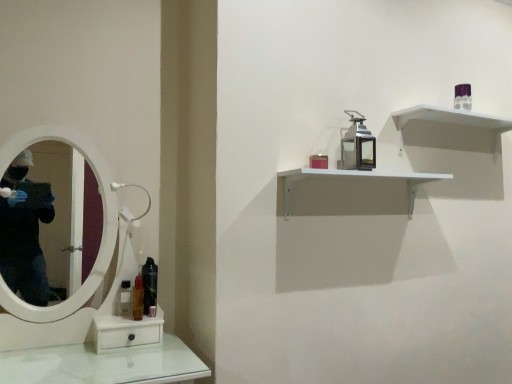
Describe the element at coordinates (463, 97) in the screenshot. I see `purple glossy perfume at upper right, arranged as the 1th toiletry when viewed from the top` at that location.

What do you see at coordinates (138, 297) in the screenshot? I see `translucent plastic mouthwash at left, marked as the 2th mouthwash in a right-to-left arrangement` at bounding box center [138, 297].

Measure the distance between point (150, 301) and camera.

Point (150, 301) is 1.67 meters from camera.

Where is `white matte shelf at upper right, which ranks as the 2th shelf in top-to-bottom order`? The height and width of the screenshot is (384, 512). white matte shelf at upper right, which ranks as the 2th shelf in top-to-bottom order is located at coordinates (357, 176).

Locate an element on the screen. The height and width of the screenshot is (384, 512). matte red candle at upper center, which is the 1th toiletry in bottom-to-top order is located at coordinates (318, 161).

This screenshot has height=384, width=512. Identify the location of purple glossy perfume at upper right, the 2th toiletry positioned from the bottom. (463, 97).

Could you measure the distance between white matte shelf at upper right, which ranks as the 2th shelf in top-to-bottom order, and black glossy mouthwash at lower left, the first mouthwash viewed from the right?

white matte shelf at upper right, which ranks as the 2th shelf in top-to-bottom order, and black glossy mouthwash at lower left, the first mouthwash viewed from the right, are 32.02 inches apart from each other.

You are a GUI agent. You are given a task and a screenshot of the screen. Output one action in this format:
    pyautogui.click(x=<x>, y=<y>)
    Task: Click on the 1st mouthwash to the left when counting from the white matte shelf at upper right, which ranks as the 1th shelf in bottom-to-top order
    The height and width of the screenshot is (384, 512).
    Given the screenshot: What is the action you would take?
    pyautogui.click(x=150, y=287)

Which is in front, point (442, 175) or point (146, 303)?

Point (146, 303)

Is white matte shelf at upper right, which ranks as the 2th shelf in top-to-bottom order, with black glossy mouthwash at lower left, the first mouthwash viewed from the right?

No, white matte shelf at upper right, which ranks as the 2th shelf in top-to-bottom order, is not next to black glossy mouthwash at lower left, the first mouthwash viewed from the right.

From the picture: Considering the sizes of white matte shelf at upper right, which appears as the second shelf when ordered from the bottom, and clear plastic bottle at lower left, which is the 1th mouthwash in left-to-right order, in the image, is white matte shelf at upper right, which appears as the second shelf when ordered from the bottom, wider or thinner than clear plastic bottle at lower left, which is the 1th mouthwash in left-to-right order,?

Clearly, white matte shelf at upper right, which appears as the second shelf when ordered from the bottom, has more width compared to clear plastic bottle at lower left, which is the 1th mouthwash in left-to-right order.

Is white matte shelf at upper right, acting as the 1th shelf starting from the top, placed right next to clear plastic bottle at lower left, which is the 3th mouthwash in right-to-left order?

white matte shelf at upper right, acting as the 1th shelf starting from the top, and clear plastic bottle at lower left, which is the 3th mouthwash in right-to-left order, are not in contact.

Is white matte shelf at upper right, acting as the 1th shelf starting from the top, taller or shorter than clear plastic bottle at lower left, which is the 3th mouthwash in right-to-left order?

white matte shelf at upper right, acting as the 1th shelf starting from the top, is taller than clear plastic bottle at lower left, which is the 3th mouthwash in right-to-left order.

Considering the relative sizes of matte red candle at upper center, the second toiletry from the top, and white matte shelf at upper right, which ranks as the 2th shelf in top-to-bottom order, in the image provided, is matte red candle at upper center, the second toiletry from the top, shorter than white matte shelf at upper right, which ranks as the 2th shelf in top-to-bottom order,?

Yes.

Considering the points (324, 163) and (408, 187), which point is behind, point (324, 163) or point (408, 187)?

The point (408, 187) is more distant.

Measure the distance between matte red candle at upper center, marked as the 1th toiletry in a left-to-right arrangement, and white matte shelf at upper right, which ranks as the 2th shelf in top-to-bottom order.

They are 8.74 inches apart.

From the image's perspective, is matte red candle at upper center, which is the first toiletry in front-to-back order, above white matte shelf at upper right, which ranks as the 1th shelf in bottom-to-top order?

Yes, from the image's perspective, matte red candle at upper center, which is the first toiletry in front-to-back order, is above white matte shelf at upper right, which ranks as the 1th shelf in bottom-to-top order.

From the image's perspective, which one is positioned lower, purple glossy perfume at upper right, the 2th toiletry from the front, or black glossy mouthwash at lower left, which appears as the third mouthwash when viewed from the left?

From the image's view, black glossy mouthwash at lower left, which appears as the third mouthwash when viewed from the left, is below.

Considering the relative positions of purple glossy perfume at upper right, the 2th toiletry positioned from the bottom, and black glossy mouthwash at lower left, which appears as the third mouthwash when viewed from the left, in the image provided, is purple glossy perfume at upper right, the 2th toiletry positioned from the bottom, to the left or to the right of black glossy mouthwash at lower left, which appears as the third mouthwash when viewed from the left,?

From the image, it's evident that purple glossy perfume at upper right, the 2th toiletry positioned from the bottom, is to the right of black glossy mouthwash at lower left, which appears as the third mouthwash when viewed from the left.

In terms of height, does purple glossy perfume at upper right, arranged as the 1th toiletry when viewed from the top, look taller or shorter compared to black glossy mouthwash at lower left, which appears as the third mouthwash when viewed from the left?

Clearly, purple glossy perfume at upper right, arranged as the 1th toiletry when viewed from the top, is shorter compared to black glossy mouthwash at lower left, which appears as the third mouthwash when viewed from the left.

Are white matte shelf at upper right, which ranks as the 1th shelf in bottom-to-top order, and clear plastic bottle at lower left, which is the 1th mouthwash in left-to-right order, located far from each other?

No, white matte shelf at upper right, which ranks as the 1th shelf in bottom-to-top order, is not far away from clear plastic bottle at lower left, which is the 1th mouthwash in left-to-right order.

From the image's perspective, who appears lower, white matte shelf at upper right, which ranks as the 2th shelf in top-to-bottom order, or clear plastic bottle at lower left, which is the 1th mouthwash in left-to-right order?

clear plastic bottle at lower left, which is the 1th mouthwash in left-to-right order, is shown below in the image.

From a real-world perspective, is white matte shelf at upper right, which ranks as the 1th shelf in bottom-to-top order, physically below clear plastic bottle at lower left, which is the 3th mouthwash in right-to-left order?

No, from a real-world perspective, white matte shelf at upper right, which ranks as the 1th shelf in bottom-to-top order, is not beneath clear plastic bottle at lower left, which is the 3th mouthwash in right-to-left order.

Does black glossy mouthwash at lower left, the first mouthwash viewed from the right, have a smaller size compared to matte red candle at upper center, which is the first toiletry in front-to-back order?

Incorrect, black glossy mouthwash at lower left, the first mouthwash viewed from the right, is not smaller in size than matte red candle at upper center, which is the first toiletry in front-to-back order.

Considering the sizes of black glossy mouthwash at lower left, the first mouthwash viewed from the right, and matte red candle at upper center, the 2th toiletry in the right-to-left sequence, in the image, is black glossy mouthwash at lower left, the first mouthwash viewed from the right, taller or shorter than matte red candle at upper center, the 2th toiletry in the right-to-left sequence,?

In the image, black glossy mouthwash at lower left, the first mouthwash viewed from the right, appears to be taller than matte red candle at upper center, the 2th toiletry in the right-to-left sequence.

Considering the relative sizes of black glossy mouthwash at lower left, which appears as the third mouthwash when viewed from the left, and matte red candle at upper center, marked as the 1th toiletry in a left-to-right arrangement, in the image provided, is black glossy mouthwash at lower left, which appears as the third mouthwash when viewed from the left, wider than matte red candle at upper center, marked as the 1th toiletry in a left-to-right arrangement,?

No.

In order to click on the 1st mouthwash positioned below the matte red candle at upper center, the 2th toiletry in the right-to-left sequence (from the image's perspective) in this screenshot , I will do `click(150, 287)`.

Which object is further away from the camera, clear plastic bottle at lower left, which is the 1th mouthwash in left-to-right order, or white matte shelf at upper right, which ranks as the 2th shelf in top-to-bottom order?

Positioned behind is clear plastic bottle at lower left, which is the 1th mouthwash in left-to-right order.

From the image's perspective, starting from the clear plastic bottle at lower left, which is the 1th mouthwash in left-to-right order, which shelf is the 1st one above? Please provide its 2D coordinates.

[(357, 176)]

Is clear plastic bottle at lower left, which is the 3th mouthwash in right-to-left order, looking in the opposite direction of white matte shelf at upper right, which ranks as the 1th shelf in bottom-to-top order?

No, clear plastic bottle at lower left, which is the 3th mouthwash in right-to-left order, is not facing the opposite direction of white matte shelf at upper right, which ranks as the 1th shelf in bottom-to-top order.

Locate an element on the screen. The image size is (512, 384). shelf that appears in front of the black glossy mouthwash at lower left, the first mouthwash viewed from the right is located at coordinates (x=357, y=176).

From a real-world perspective, starting from the clear plastic bottle at lower left, which is the 3th mouthwash in right-to-left order, which shelf is the 2nd one vertically above it? Please provide its 2D coordinates.

[(452, 121)]

From the image, which object appears to be nearer to translucent plastic mouthwash at left, which ranks as the second mouthwash in left-to-right order, purple glossy perfume at upper right, positioned as the 1th toiletry in back-to-front order, or black glossy mouthwash at lower left, which appears as the third mouthwash when viewed from the left?

black glossy mouthwash at lower left, which appears as the third mouthwash when viewed from the left, lies closer to translucent plastic mouthwash at left, which ranks as the second mouthwash in left-to-right order, than the other object.

Which object lies further to the anchor point white matte shelf at upper right, acting as the 1th shelf starting from the top, translucent plastic mouthwash at left, marked as the 2th mouthwash in a right-to-left arrangement, or purple glossy perfume at upper right, positioned as the 1th toiletry in back-to-front order?

translucent plastic mouthwash at left, marked as the 2th mouthwash in a right-to-left arrangement, is positioned further to the anchor white matte shelf at upper right, acting as the 1th shelf starting from the top.

Estimate the real-world distances between objects in this image. Which object is further from matte red candle at upper center, which is the first toiletry in front-to-back order, white matte shelf at upper right, which appears as the second shelf when ordered from the bottom, or white matte shelf at upper right, which ranks as the 1th shelf in bottom-to-top order?

Among the two, white matte shelf at upper right, which appears as the second shelf when ordered from the bottom, is located further to matte red candle at upper center, which is the first toiletry in front-to-back order.

From the image, which object appears to be farther from clear plastic bottle at lower left, which is the 1th mouthwash in left-to-right order, purple glossy perfume at upper right, the 1th toiletry in the right-to-left sequence, or white matte shelf at upper right, which appears as the second shelf when ordered from the bottom?

purple glossy perfume at upper right, the 1th toiletry in the right-to-left sequence, is positioned further to the anchor clear plastic bottle at lower left, which is the 1th mouthwash in left-to-right order.

In the scene shown: Estimate the real-world distances between objects in this image. Which object is further from purple glossy perfume at upper right, the 2th toiletry positioned from the bottom, matte red candle at upper center, marked as the 1th toiletry in a left-to-right arrangement, or translucent plastic mouthwash at left, marked as the 2th mouthwash in a right-to-left arrangement?

translucent plastic mouthwash at left, marked as the 2th mouthwash in a right-to-left arrangement, is further to purple glossy perfume at upper right, the 2th toiletry positioned from the bottom.

Based on their spatial positions, is black glossy mouthwash at lower left, the first mouthwash viewed from the right, or white matte shelf at upper right, which ranks as the 2th shelf in top-to-bottom order, further from matte red candle at upper center, which is the 1th toiletry in bottom-to-top order?

The object further to matte red candle at upper center, which is the 1th toiletry in bottom-to-top order, is black glossy mouthwash at lower left, the first mouthwash viewed from the right.

Looking at the image, which one is located further to purple glossy perfume at upper right, positioned as the 1th toiletry in back-to-front order, clear plastic bottle at lower left, which is the 3th mouthwash in right-to-left order, or black glossy mouthwash at lower left, which appears as the third mouthwash when viewed from the left?

The object further to purple glossy perfume at upper right, positioned as the 1th toiletry in back-to-front order, is clear plastic bottle at lower left, which is the 3th mouthwash in right-to-left order.

Which object lies further to the anchor point translucent plastic mouthwash at left, which ranks as the second mouthwash in left-to-right order, purple glossy perfume at upper right, positioned as the 1th toiletry in back-to-front order, or white matte shelf at upper right, which ranks as the 2th shelf in top-to-bottom order?

purple glossy perfume at upper right, positioned as the 1th toiletry in back-to-front order, is positioned further to the anchor translucent plastic mouthwash at left, which ranks as the second mouthwash in left-to-right order.

Find the location of a particular element. toiletry between clear plastic bottle at lower left, which is the 3th mouthwash in right-to-left order, and white matte shelf at upper right, which ranks as the 1th shelf in bottom-to-top order, in the horizontal direction is located at coordinates pyautogui.click(x=318, y=161).

Find the location of `mouthwash between clear plastic bottle at lower left, which is the 1th mouthwash in left-to-right order, and black glossy mouthwash at lower left, the first mouthwash viewed from the right, from left to right`. mouthwash between clear plastic bottle at lower left, which is the 1th mouthwash in left-to-right order, and black glossy mouthwash at lower left, the first mouthwash viewed from the right, from left to right is located at coordinates (138, 297).

Where is `shelf between clear plastic bottle at lower left, which is the 3th mouthwash in right-to-left order, and purple glossy perfume at upper right, the 2th toiletry positioned from the bottom, in the horizontal direction`? This screenshot has width=512, height=384. shelf between clear plastic bottle at lower left, which is the 3th mouthwash in right-to-left order, and purple glossy perfume at upper right, the 2th toiletry positioned from the bottom, in the horizontal direction is located at coordinates (357, 176).

Image resolution: width=512 pixels, height=384 pixels. I want to click on shelf between translucent plastic mouthwash at left, which ranks as the second mouthwash in left-to-right order, and purple glossy perfume at upper right, positioned as the 1th toiletry in back-to-front order, so click(x=357, y=176).